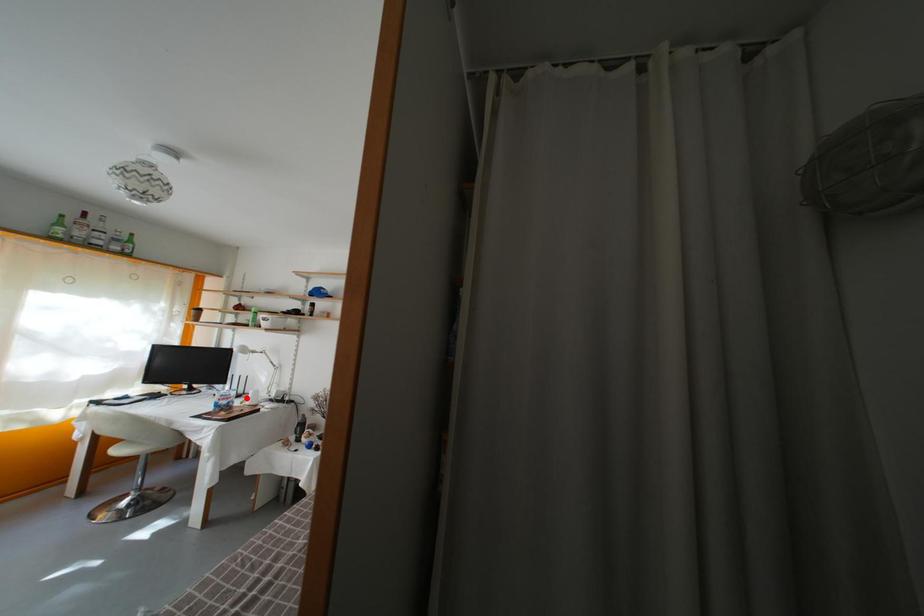
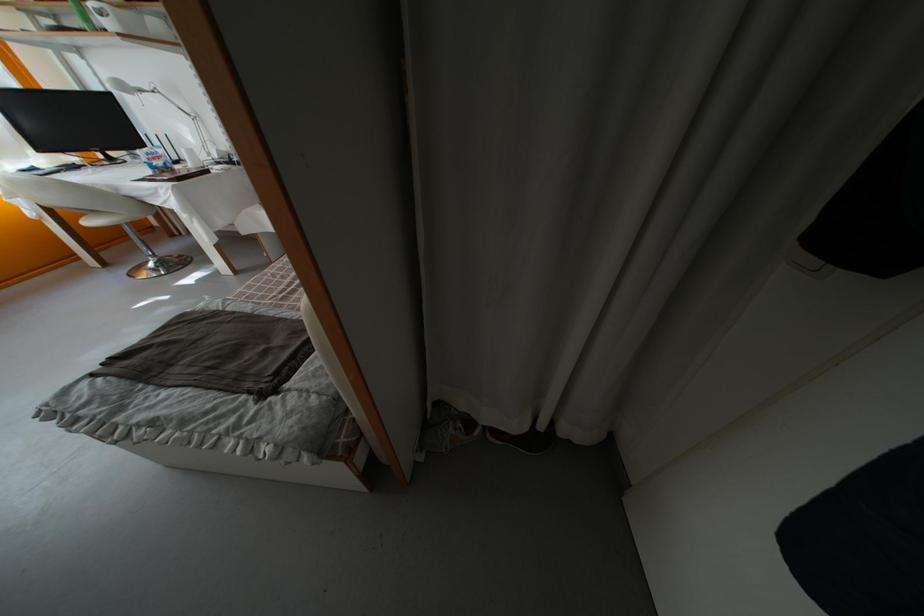
Question: I am providing you with two images of the same scene from different viewpoints. Given a red point in image1, look at the same physical point in image2. Is it:

Choices:
 (A) Closer to the viewpoint
 (B) Farther from the viewpoint

Answer: (A)